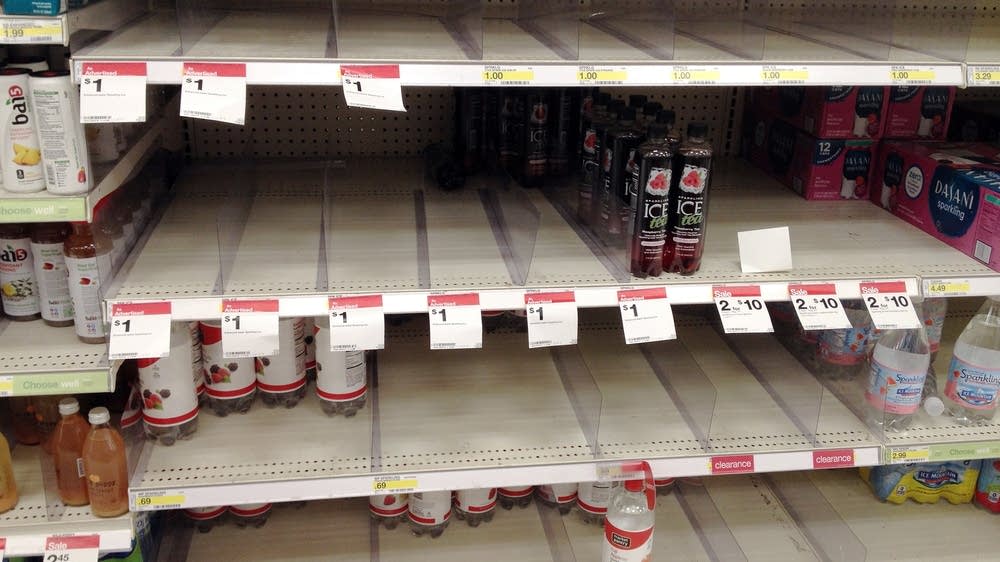
I want to click on metal shelf, so click(x=444, y=447), click(x=463, y=258), click(x=426, y=35).